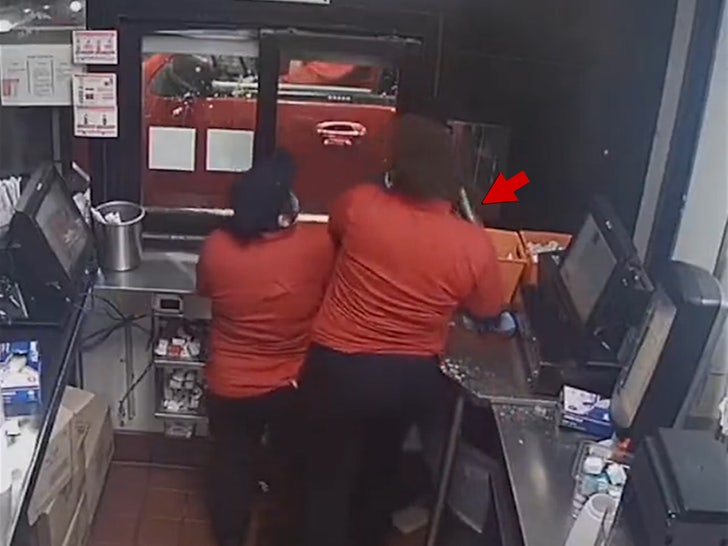
Image resolution: width=728 pixels, height=546 pixels. I want to click on box, so click(19, 372).